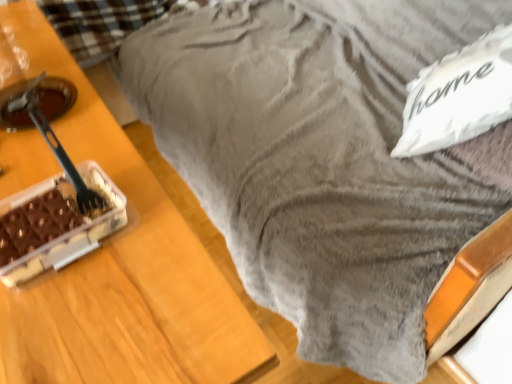
The width and height of the screenshot is (512, 384). I want to click on unoccupied space behind black plastic fork at left, so click(88, 140).